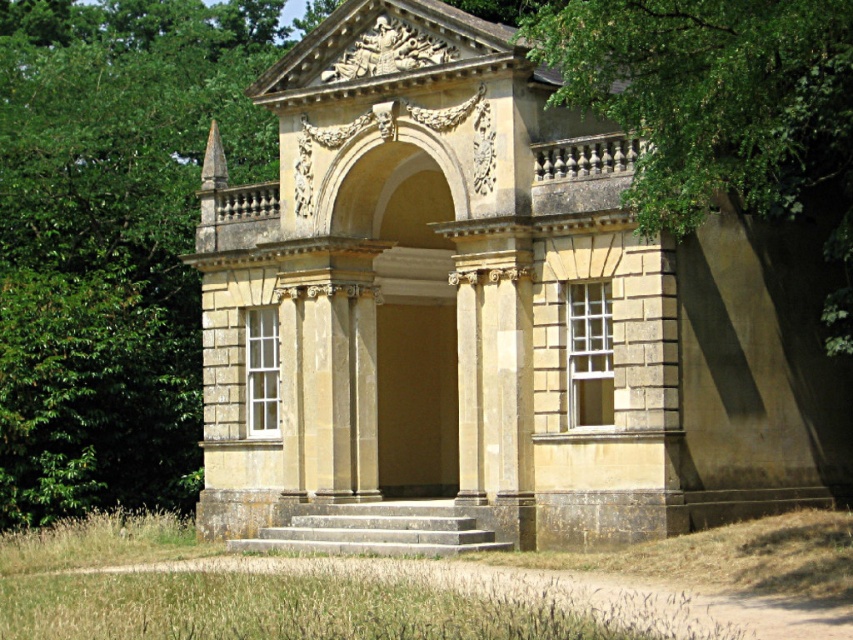
Measure the distance from beige stone building at center to smooth stone stairs at center.

beige stone building at center is 6.31 meters away from smooth stone stairs at center.

Describe the element at coordinates (492, 310) in the screenshot. This screenshot has width=853, height=640. I see `beige stone building at center` at that location.

Who is more forward, [553,419] or [294,529]?

Point [553,419]

I want to click on beige stone building at center, so coord(492,310).

Can you confirm if beige stone building at center is smaller than green leafy tree at left?

Yes, beige stone building at center is smaller than green leafy tree at left.

Is beige stone building at center further to the viewer compared to green leafy tree at left?

No, beige stone building at center is in front of green leafy tree at left.

Where is `beige stone building at center`? This screenshot has width=853, height=640. beige stone building at center is located at coordinates (492, 310).

Does green leafy tree at left appear under green leafy tree at upper right?

Indeed, green leafy tree at left is positioned under green leafy tree at upper right.

Is point (88, 160) positioned in front of point (809, 147)?

No, it is not.

Find the location of a particular element. The width and height of the screenshot is (853, 640). green leafy tree at left is located at coordinates (111, 237).